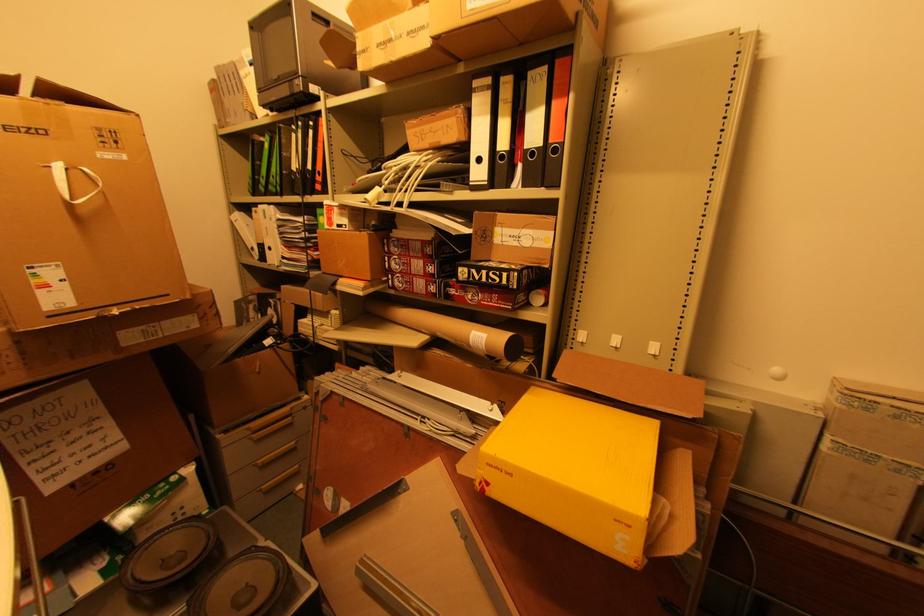
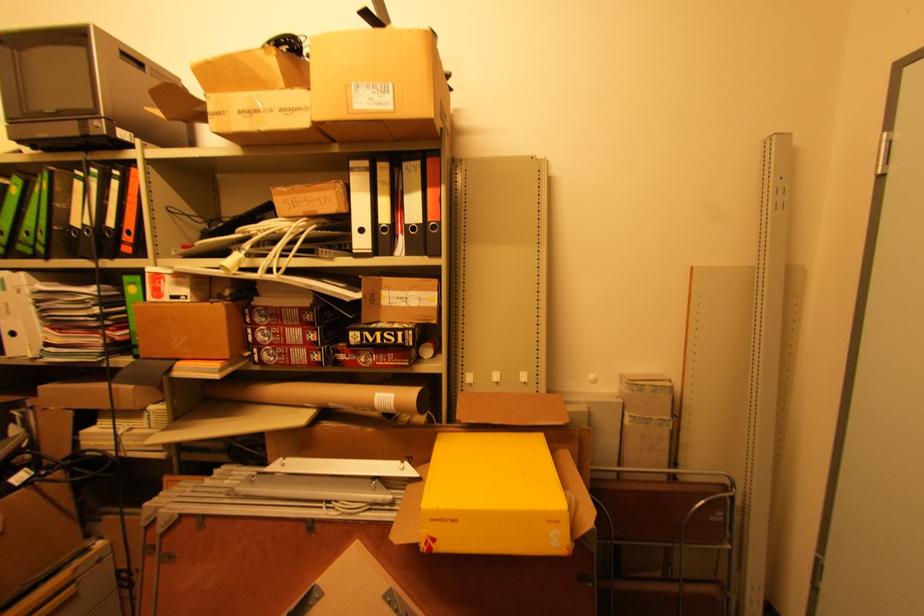
Locate, in the second image, the point that corresponds to the point at 483,347 in the first image.

(392, 408)